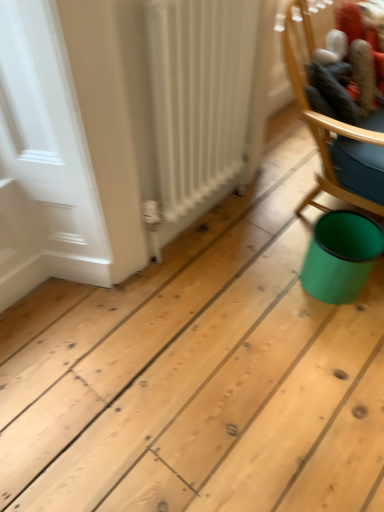
What is the approximate height of wooden chair at upper right?

The height of wooden chair at upper right is 13.90 inches.

Describe the element at coordinates (200, 96) in the screenshot. I see `white matte radiator at left` at that location.

You are a GUI agent. You are given a task and a screenshot of the screen. Output one action in this format:
    pyautogui.click(x=<x>, y=<y>)
    Task: Click on the white matte radiator at left
    Image resolution: width=384 pixels, height=512 pixels.
    Given the screenshot: What is the action you would take?
    pyautogui.click(x=200, y=96)

The width and height of the screenshot is (384, 512). What are the coordinates of `wooden chair at upper right` in the screenshot? It's located at (338, 116).

Is teal plastic can at lower right oriented towards white matte radiator at left?

No, teal plastic can at lower right is not facing towards white matte radiator at left.

Are teal plastic can at lower right and white matte radiator at left far apart?

No.

From a real-world perspective, is teal plastic can at lower right physically located above or below white matte radiator at left?

teal plastic can at lower right is below white matte radiator at left.

How far apart are teal plastic can at lower right and white matte radiator at left?

The distance of teal plastic can at lower right from white matte radiator at left is 21.98 inches.

Which point is more distant from viewer, [317,283] or [366,170]?

The point [366,170] is more distant.

The width and height of the screenshot is (384, 512). I want to click on teal lying on the right of wooden chair at upper right, so 341,256.

Based on the photo, can you confirm if teal plastic can at lower right is positioned to the left of wooden chair at upper right?

No, teal plastic can at lower right is not to the left of wooden chair at upper right.

Which of these two, teal plastic can at lower right or wooden chair at upper right, is bigger?

With larger size is wooden chair at upper right.

The width and height of the screenshot is (384, 512). What are the coordinates of `radiator on the left of wooden chair at upper right` in the screenshot? It's located at [x=200, y=96].

Can you confirm if wooden chair at upper right is bigger than white matte radiator at left?

No.

Could you tell me if wooden chair at upper right is turned towards white matte radiator at left?

No, wooden chair at upper right is not turned towards white matte radiator at left.

From the picture: What's the angular difference between wooden chair at upper right and white matte radiator at left's facing directions?

2.72 degrees.

Is point (240, 110) closer to camera compared to point (333, 237)?

Yes, point (240, 110) is closer to viewer.

From a real-world perspective, which is physically above, white matte radiator at left or teal plastic can at lower right?

In real-world perspective, white matte radiator at left is above.

From their relative heights in the image, would you say white matte radiator at left is taller or shorter than teal plastic can at lower right?

Considering their sizes, white matte radiator at left has more height than teal plastic can at lower right.

Find the location of a particular element. radiator that is in front of the teal plastic can at lower right is located at coordinates (200, 96).

Based on their sizes in the image, would you say white matte radiator at left is bigger or smaller than wooden chair at upper right?

In the image, white matte radiator at left appears to be larger than wooden chair at upper right.

From a real-world perspective, does white matte radiator at left sit lower than wooden chair at upper right?

Yes, from a real-world perspective, white matte radiator at left is below wooden chair at upper right.

Is wooden chair at upper right at the back of white matte radiator at left?

white matte radiator at left does not have its back to wooden chair at upper right.

Can you see white matte radiator at left touching wooden chair at upper right?

white matte radiator at left is not next to wooden chair at upper right, and they're not touching.

Is teal plastic can at lower right completely or partially inside wooden chair at upper right?

Actually, teal plastic can at lower right is outside wooden chair at upper right.

Is the position of wooden chair at upper right less distant than that of teal plastic can at lower right?

Yes, wooden chair at upper right is closer to the camera.

What's the angular difference between wooden chair at upper right and teal plastic can at lower right's facing directions?

There is a 2.72-degree angle between the facing directions of wooden chair at upper right and teal plastic can at lower right.

Does wooden chair at upper right have a larger size compared to teal plastic can at lower right?

Yes, wooden chair at upper right is bigger than teal plastic can at lower right.

Find the location of a particular element. The height and width of the screenshot is (512, 384). radiator above the teal plastic can at lower right (from the image's perspective) is located at coordinates (200, 96).

At what (x,y) coordinates should I click in order to perform the action: click on teal located below the wooden chair at upper right (from the image's perspective). Please return your answer as a coordinate pair (x, y). The width and height of the screenshot is (384, 512). Looking at the image, I should click on (341, 256).

Consider the image. Looking at the image, which one is located closer to white matte radiator at left, wooden chair at upper right or teal plastic can at lower right?

Based on the image, wooden chair at upper right appears to be nearer to white matte radiator at left.

Estimate the real-world distances between objects in this image. Which object is further from white matte radiator at left, teal plastic can at lower right or wooden chair at upper right?

Based on the image, teal plastic can at lower right appears to be further to white matte radiator at left.

Estimate the real-world distances between objects in this image. Which object is further from wooden chair at upper right, white matte radiator at left or teal plastic can at lower right?

white matte radiator at left lies further to wooden chair at upper right than the other object.

Considering their positions, is white matte radiator at left positioned closer to teal plastic can at lower right than wooden chair at upper right?

The object closer to teal plastic can at lower right is wooden chair at upper right.

When comparing their distances from wooden chair at upper right, does teal plastic can at lower right or white matte radiator at left seem further?

white matte radiator at left is further to wooden chair at upper right.

From the image, which object appears to be nearer to teal plastic can at lower right, wooden chair at upper right or white matte radiator at left?

The object closer to teal plastic can at lower right is wooden chair at upper right.

Where is `radiator between wooden chair at upper right and teal plastic can at lower right in the up-down direction`? The height and width of the screenshot is (512, 384). radiator between wooden chair at upper right and teal plastic can at lower right in the up-down direction is located at coordinates point(200,96).